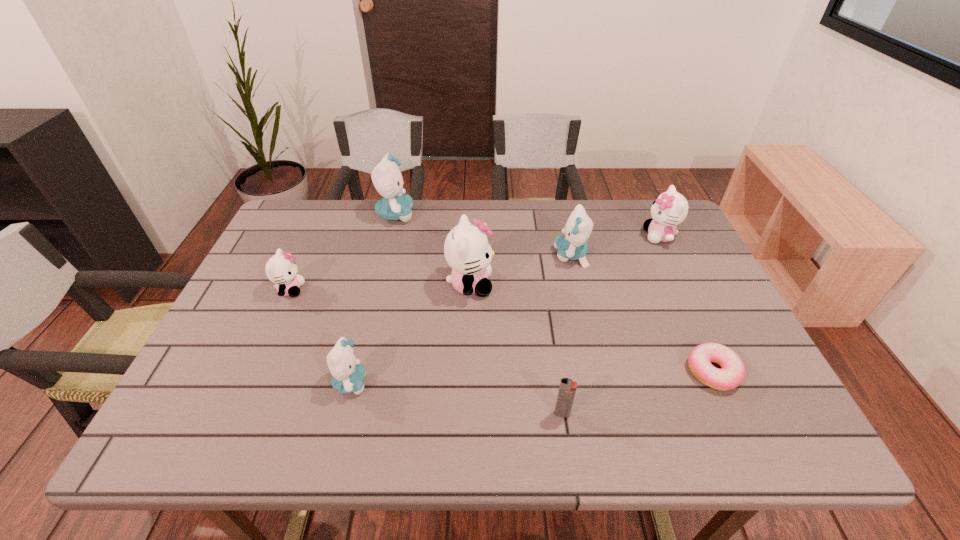
The height and width of the screenshot is (540, 960). What are the coordinates of `doughnut present at the right edge` in the screenshot? It's located at coord(732,374).

Find the location of `object present at the far right corner`. object present at the far right corner is located at coordinates (670, 209).

In the image, there is a desktop. Where is `blank space at the far edge`? Image resolution: width=960 pixels, height=540 pixels. blank space at the far edge is located at coordinates (611, 231).

Locate an element on the screen. The height and width of the screenshot is (540, 960). free space at the near edge of the desktop is located at coordinates (407, 423).

Identify the location of vacant space at the left edge. The height and width of the screenshot is (540, 960). (289, 310).

In the image, there is a desktop. Identify the location of vacant space at the right edge. Image resolution: width=960 pixels, height=540 pixels. (729, 319).

Identify the location of free spot at the far left corner of the desktop. (291, 217).

The width and height of the screenshot is (960, 540). I want to click on vacant space at the near left corner of the desktop, so point(183,426).

The width and height of the screenshot is (960, 540). I want to click on blank space at the far right corner of the desktop, so click(679, 235).

Where is `free space at the near right corner of the desktop`? The image size is (960, 540). free space at the near right corner of the desktop is located at coordinates (763, 421).